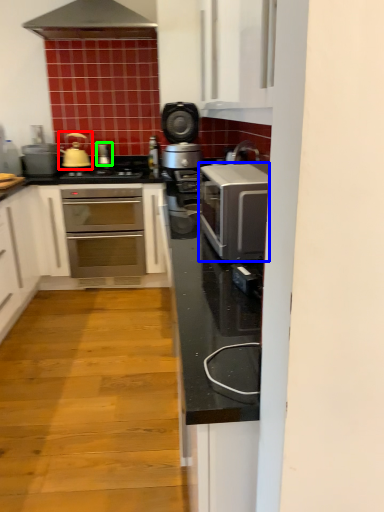
Question: Which is farther away from tea pot (highlighted by a red box)? kitchen appliance (highlighted by a blue box) or appliance (highlighted by a green box)?

Choices:
 (A) kitchen appliance
 (B) appliance

Answer: (A)